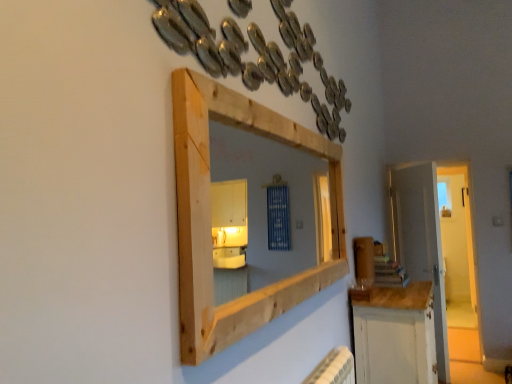
Question: In which direction should I rotate to look at natural wood medicine cabinet at upper center?

Choices:
 (A) left
 (B) right

Answer: (B)

Question: Is white painted wood cabinet at lower right wider than white wooden door at right?

Choices:
 (A) no
 (B) yes

Answer: (B)

Question: Is white painted wood cabinet at lower right positioned before white wooden door at right?

Choices:
 (A) yes
 (B) no

Answer: (A)

Question: Is white wooden door at right a part of white painted wood cabinet at lower right?

Choices:
 (A) no
 (B) yes

Answer: (A)

Question: Considering the relative sizes of white painted wood cabinet at lower right and white wooden door at right in the image provided, is white painted wood cabinet at lower right taller than white wooden door at right?

Choices:
 (A) no
 (B) yes

Answer: (A)

Question: Is white painted wood cabinet at lower right further to the viewer compared to white wooden door at right?

Choices:
 (A) no
 (B) yes

Answer: (A)

Question: Is white painted wood cabinet at lower right positioned far away from white wooden door at right?

Choices:
 (A) yes
 (B) no

Answer: (B)

Question: Would you consider white painted wood cabinet at lower right to be distant from natural wood medicine cabinet at upper center?

Choices:
 (A) yes
 (B) no

Answer: (B)

Question: Is the depth of white painted wood cabinet at lower right greater than that of natural wood medicine cabinet at upper center?

Choices:
 (A) yes
 (B) no

Answer: (A)

Question: Considering the relative sizes of white painted wood cabinet at lower right and natural wood medicine cabinet at upper center in the image provided, is white painted wood cabinet at lower right taller than natural wood medicine cabinet at upper center?

Choices:
 (A) no
 (B) yes

Answer: (B)

Question: Can you confirm if white painted wood cabinet at lower right is thinner than natural wood medicine cabinet at upper center?

Choices:
 (A) no
 (B) yes

Answer: (A)

Question: From a real-world perspective, is white painted wood cabinet at lower right positioned over natural wood medicine cabinet at upper center based on gravity?

Choices:
 (A) yes
 (B) no

Answer: (B)

Question: Is the depth of white painted wood cabinet at lower right less than that of natural wood medicine cabinet at upper center?

Choices:
 (A) yes
 (B) no

Answer: (B)

Question: Considering the relative sizes of natural wood medicine cabinet at upper center and white wooden door at right in the image provided, is natural wood medicine cabinet at upper center thinner than white wooden door at right?

Choices:
 (A) yes
 (B) no

Answer: (B)